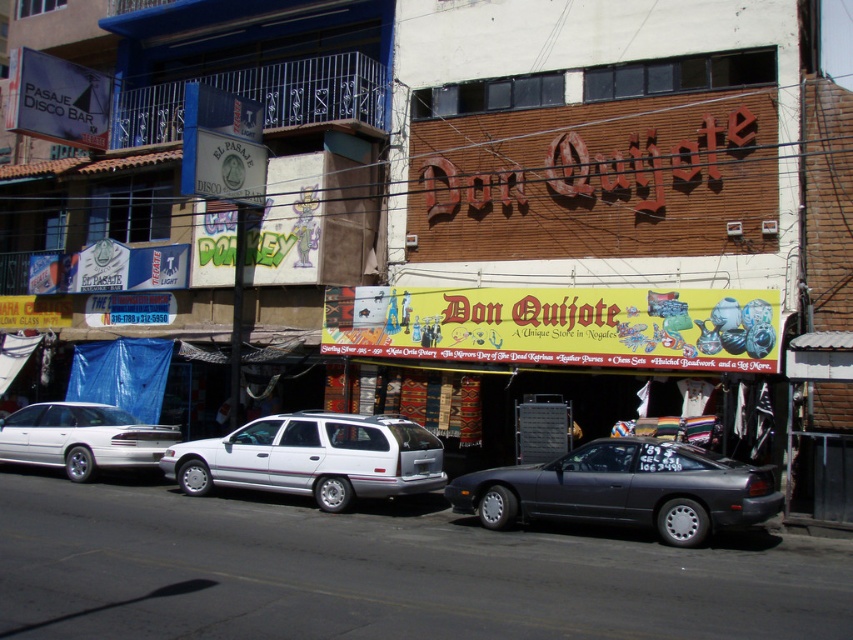
Is point (556, 461) positioned behind point (19, 456)?

No.

I want to click on metallic gray car at center, so click(x=624, y=490).

Who is lower down, metallic gray car at center or white metallic station wagon at center?

white metallic station wagon at center

Who is more distant from viewer, (502, 518) or (380, 493)?

Positioned behind is point (380, 493).

You are a GUI agent. You are given a task and a screenshot of the screen. Output one action in this format:
    pyautogui.click(x=<x>, y=<y>)
    Task: Click on the metallic gray car at center
    The image size is (853, 640).
    Given the screenshot: What is the action you would take?
    pyautogui.click(x=624, y=490)

Identify the location of metallic gray car at center. (624, 490).

Does white metallic station wagon at center have a larger size compared to white matte station wagon at left?

Yes, white metallic station wagon at center is bigger than white matte station wagon at left.

Who is lower down, white metallic station wagon at center or white matte station wagon at left?

white metallic station wagon at center is below.

Image resolution: width=853 pixels, height=640 pixels. What do you see at coordinates (312, 458) in the screenshot?
I see `white metallic station wagon at center` at bounding box center [312, 458].

I want to click on white metallic station wagon at center, so click(312, 458).